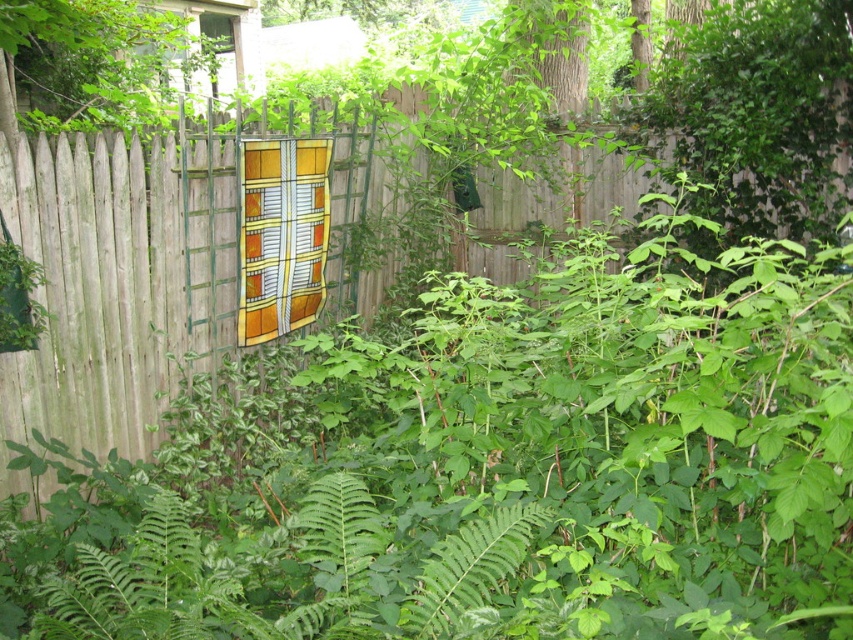
Does wooden fence at center appear on the right side of transparent glass window at upper center?

Correct, you'll find wooden fence at center to the right of transparent glass window at upper center.

Does wooden fence at center come behind transparent glass window at upper center?

No, it is not.

Identify the location of wooden fence at center. point(115,280).

Which is behind, point (131, 294) or point (84, 38)?

Point (84, 38)

Who is positioned more to the right, wooden fence at center or green leafy tree at upper left?

From the viewer's perspective, wooden fence at center appears more on the right side.

Is point (80, 378) positioned after point (44, 4)?

Yes, it is behind point (44, 4).

This screenshot has height=640, width=853. I want to click on wooden fence at center, so click(x=115, y=280).

Does green leafy tree at upper left have a smaller size compared to transparent glass window at upper center?

Actually, green leafy tree at upper left might be larger than transparent glass window at upper center.

Is point (99, 1) less distant than point (204, 16)?

Yes, it is in front of point (204, 16).

Who is more distant from viewer, (15, 28) or (206, 33)?

The point (206, 33) is behind.

Find the location of a particular element. The width and height of the screenshot is (853, 640). green leafy tree at upper left is located at coordinates (85, 61).